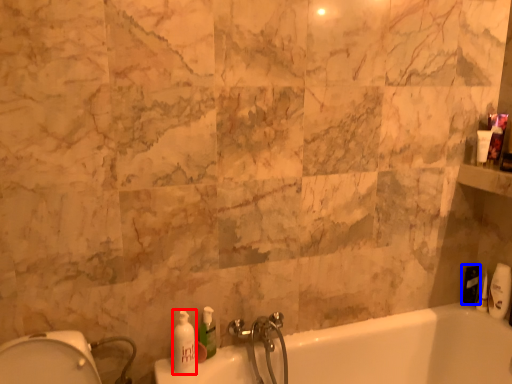
Question: Which object is closer to the camera taking this photo, soap dispenser (highlighted by a red box) or toiletry (highlighted by a blue box)?

Choices:
 (A) soap dispenser
 (B) toiletry

Answer: (A)